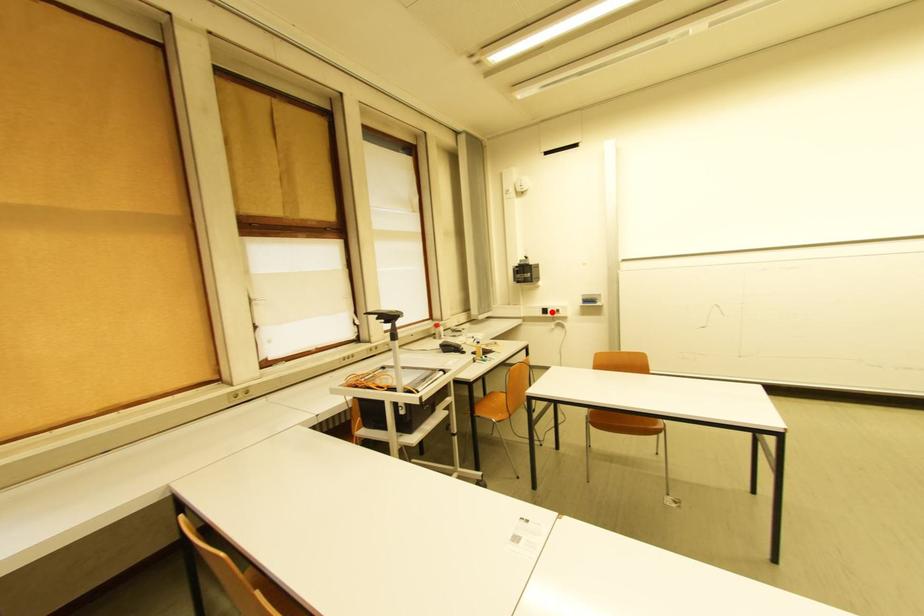
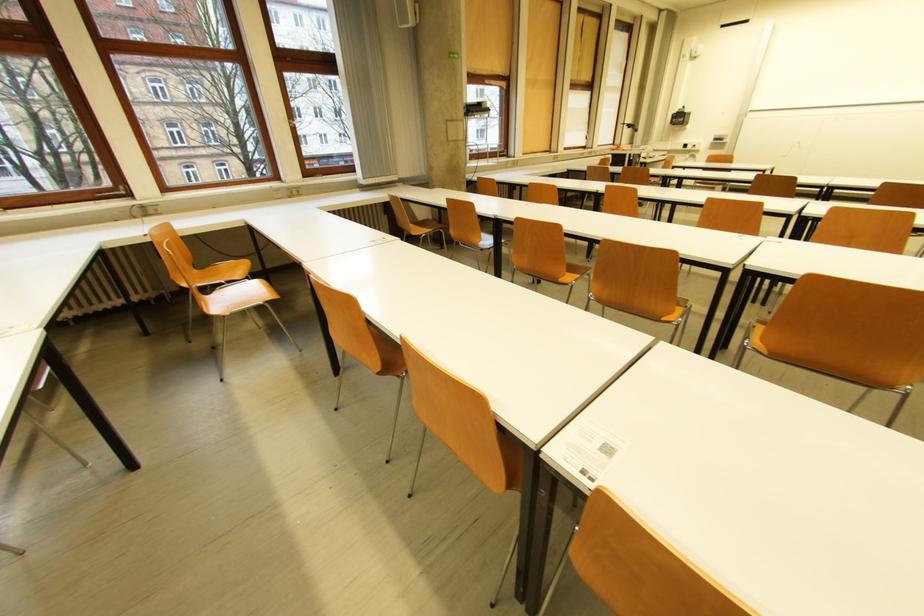
Locate, in the second image, the point that corresponds to the highlighted location in the first image.

(691, 147)